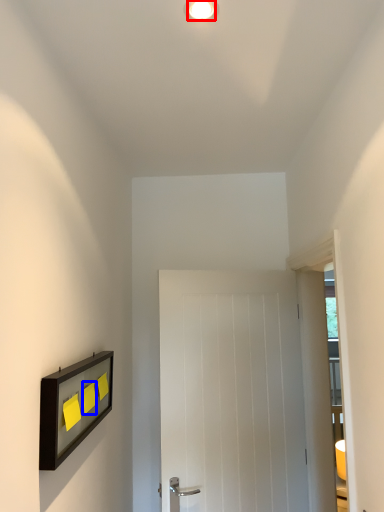
Question: Which object appears closest to the camera in this image, light fixture (highlighted by a red box) or light switch (highlighted by a blue box)?

Choices:
 (A) light fixture
 (B) light switch

Answer: (A)